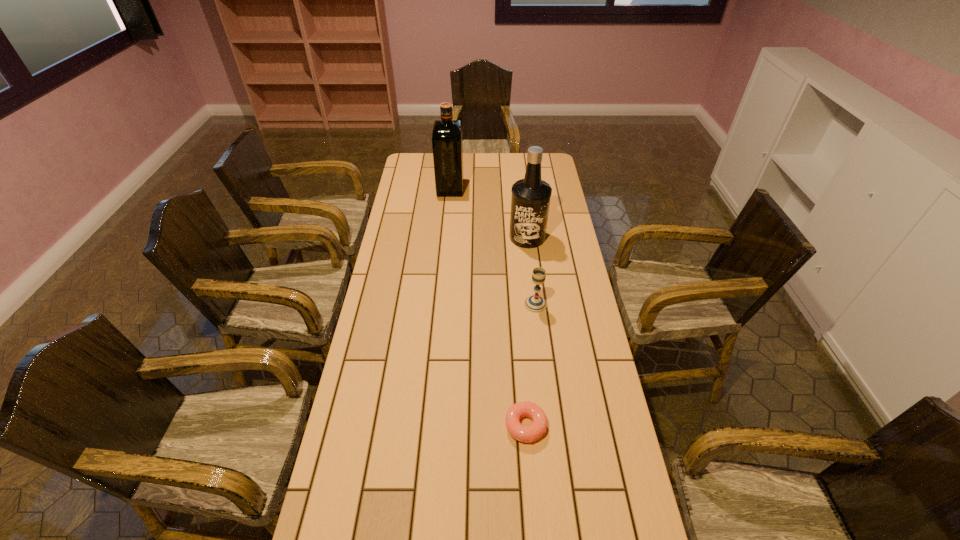
Locate an element on the screen. blank area located on the front of the chalice is located at coordinates (544, 380).

Where is `vacant space situated 0.070m on the left of the doughnut`? This screenshot has width=960, height=540. vacant space situated 0.070m on the left of the doughnut is located at coordinates (480, 426).

Where is `liquor located in the right edge section of the desktop`? The width and height of the screenshot is (960, 540). liquor located in the right edge section of the desktop is located at coordinates (530, 201).

Identify the location of chalice at the right edge. This screenshot has width=960, height=540. (535, 303).

Where is `vacant space at the far edge`? Image resolution: width=960 pixels, height=540 pixels. vacant space at the far edge is located at coordinates (469, 171).

Locate an element on the screen. Image resolution: width=960 pixels, height=540 pixels. free space at the left edge of the desktop is located at coordinates click(x=375, y=303).

The height and width of the screenshot is (540, 960). In the image, there is a desktop. What are the coordinates of `free space at the right edge` in the screenshot? It's located at (593, 409).

At what (x,y) coordinates should I click in order to perform the action: click on free spot between the chalice and the right liquor. Please return your answer as a coordinate pair (x, y). Looking at the image, I should click on (532, 271).

Locate an element on the screen. This screenshot has height=540, width=960. free space between the second farthest object and the leftmost object is located at coordinates (489, 212).

The height and width of the screenshot is (540, 960). I want to click on free space between the nearer liquor and the doughnut, so click(x=526, y=332).